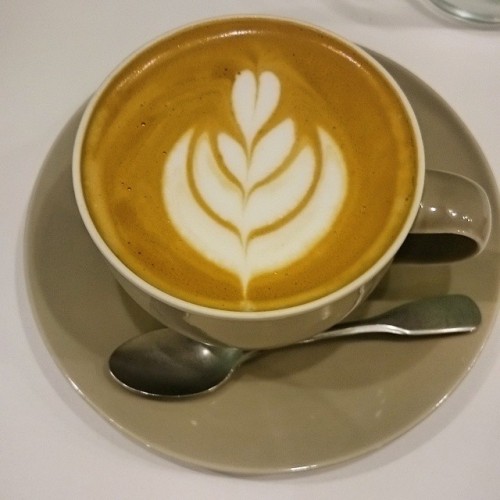
This screenshot has height=500, width=500. Identify the location of grey mug. (452, 226), (351, 271), (348, 311).